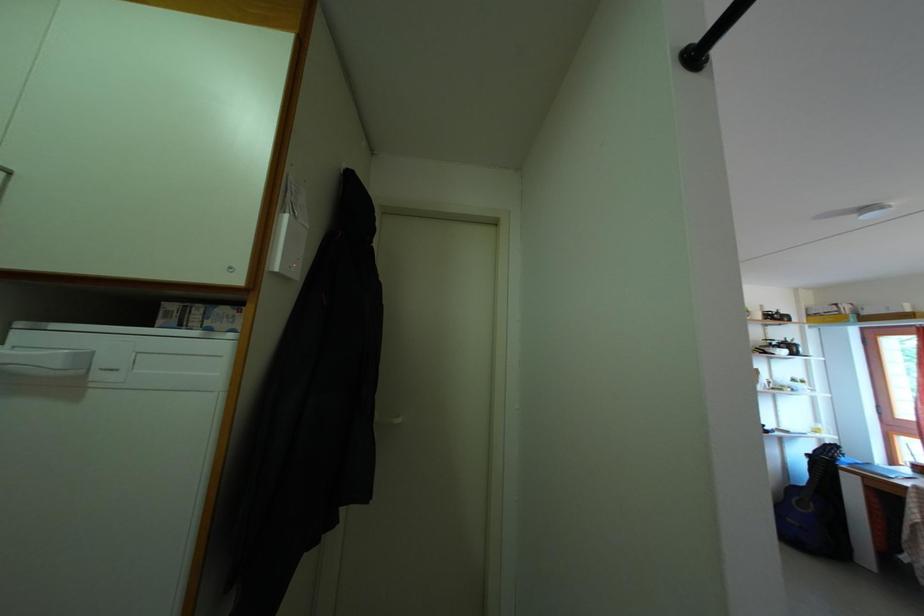
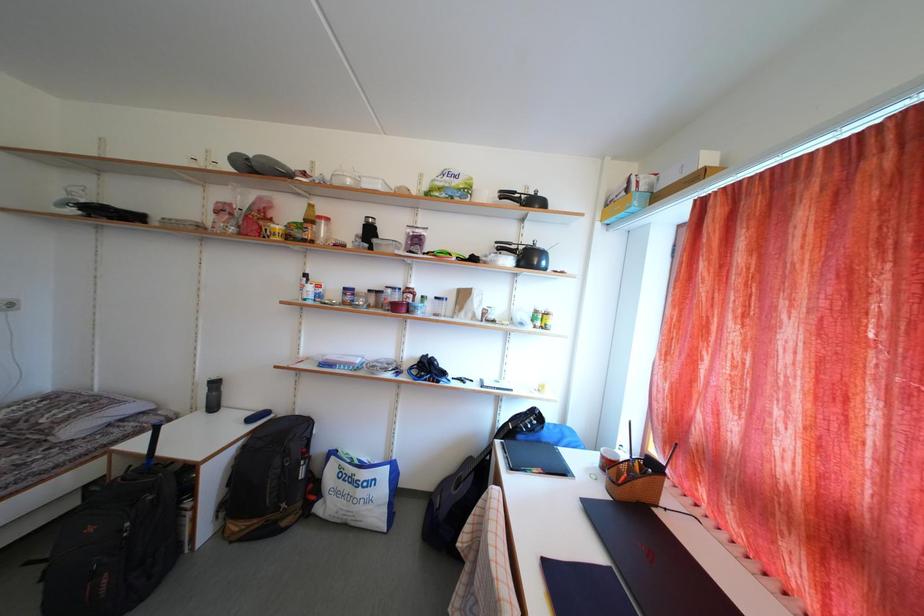
Question: What movement of the cameraman would produce the second image?

Choices:
 (A) Left
 (B) Right
 (C) Forward
 (D) Backward

Answer: (B)